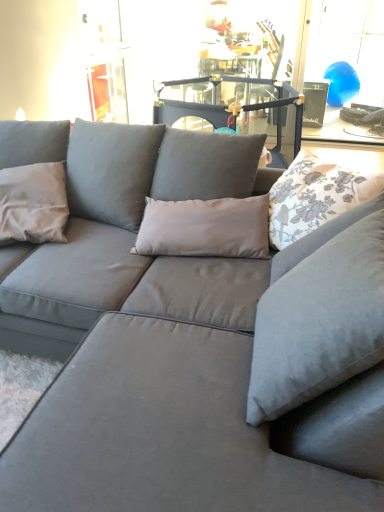
In order to face blue glossy balloon at upper right, should I rotate leftwards or rightwards?

Turn right by 20.594 degrees to look at blue glossy balloon at upper right.

Measure the distance between matte gray pillow at left, the first pillow from the left, and camera.

matte gray pillow at left, the first pillow from the left, is 5.69 feet from camera.

Identify the location of white floral fabric pillow at upper right, arranged as the second pillow when viewed from the left. The height and width of the screenshot is (512, 384). (315, 196).

Between matte gray pillow at left, the first pillow from the left, and blue glossy balloon at upper right, which one has larger width?

matte gray pillow at left, the first pillow from the left, is wider.

From the picture: From the image's perspective, which object appears higher, matte gray pillow at left, the 2th pillow positioned from the right, or blue glossy balloon at upper right?

From the image's view, blue glossy balloon at upper right is above.

Identify the location of pillow beneath the blue glossy balloon at upper right (from a real-world perspective). tap(33, 203).

Can blue glossy balloon at upper right be found inside white floral fabric pillow at upper right, arranged as the second pillow when viewed from the left?

No, blue glossy balloon at upper right is not inside white floral fabric pillow at upper right, arranged as the second pillow when viewed from the left.

From a real-world perspective, who is located lower, white floral fabric pillow at upper right, acting as the 1th pillow starting from the right, or blue glossy balloon at upper right?

From a 3D spatial view, blue glossy balloon at upper right is below.

Which of these two, white floral fabric pillow at upper right, arranged as the second pillow when viewed from the left, or blue glossy balloon at upper right, stands taller?

blue glossy balloon at upper right is taller.

Is white floral fabric pillow at upper right, arranged as the second pillow when viewed from the left, positioned before blue glossy balloon at upper right?

Yes, white floral fabric pillow at upper right, arranged as the second pillow when viewed from the left, is closer to the viewer.

I want to click on window that appears above the matte gray pillow at left, the first pillow from the left (from the image's perspective), so click(x=349, y=42).

From a real-world perspective, which object stands above the other?

From a 3D spatial view, blue glossy balloon at upper right is above.

Considering the sizes of objects blue glossy balloon at upper right and matte gray pillow at left, the first pillow from the left, in the image provided, who is thinner, blue glossy balloon at upper right or matte gray pillow at left, the first pillow from the left,?

Thinner between the two is blue glossy balloon at upper right.

Consider the image. Is blue glossy balloon at upper right shorter than matte gray pillow at left, the 2th pillow positioned from the right?

No.

From the image's perspective, does matte gray pillow at left, the 2th pillow positioned from the right, appear lower than white floral fabric pillow at upper right, acting as the 1th pillow starting from the right?

Indeed, from the image's perspective, matte gray pillow at left, the 2th pillow positioned from the right, is shown beneath white floral fabric pillow at upper right, acting as the 1th pillow starting from the right.

Is matte gray pillow at left, the 2th pillow positioned from the right, wider or thinner than white floral fabric pillow at upper right, acting as the 1th pillow starting from the right?

Clearly, matte gray pillow at left, the 2th pillow positioned from the right, has less width compared to white floral fabric pillow at upper right, acting as the 1th pillow starting from the right.

Is matte gray pillow at left, the 2th pillow positioned from the right, positioned with its back to white floral fabric pillow at upper right, acting as the 1th pillow starting from the right?

That's not correct — matte gray pillow at left, the 2th pillow positioned from the right, is not looking away from white floral fabric pillow at upper right, acting as the 1th pillow starting from the right.

Is white floral fabric pillow at upper right, acting as the 1th pillow starting from the right, taller or shorter than matte gray pillow at left, the 2th pillow positioned from the right?

In the image, white floral fabric pillow at upper right, acting as the 1th pillow starting from the right, appears to be shorter than matte gray pillow at left, the 2th pillow positioned from the right.

From a real-world perspective, relative to matte gray pillow at left, the first pillow from the left, is white floral fabric pillow at upper right, arranged as the second pillow when viewed from the left, vertically above or below?

Clearly, from a real-world perspective, white floral fabric pillow at upper right, arranged as the second pillow when viewed from the left, is above matte gray pillow at left, the first pillow from the left.

Looking at this image, choose the correct answer: Is white floral fabric pillow at upper right, arranged as the second pillow when viewed from the left, inside matte gray pillow at left, the 2th pillow positioned from the right, or outside it?

white floral fabric pillow at upper right, arranged as the second pillow when viewed from the left, lies outside matte gray pillow at left, the 2th pillow positioned from the right.

Considering the positions of points (297, 233) and (4, 244), is point (297, 233) closer to camera compared to point (4, 244)?

Yes, it is.

In terms of size, does blue glossy balloon at upper right appear bigger or smaller than white floral fabric pillow at upper right, arranged as the second pillow when viewed from the left?

In the image, blue glossy balloon at upper right appears to be larger than white floral fabric pillow at upper right, arranged as the second pillow when viewed from the left.

Is blue glossy balloon at upper right aimed at white floral fabric pillow at upper right, arranged as the second pillow when viewed from the left?

Yes, blue glossy balloon at upper right is facing white floral fabric pillow at upper right, arranged as the second pillow when viewed from the left.

From a real-world perspective, is blue glossy balloon at upper right below white floral fabric pillow at upper right, arranged as the second pillow when viewed from the left?

Yes, from a real-world perspective, blue glossy balloon at upper right is below white floral fabric pillow at upper right, arranged as the second pillow when viewed from the left.

Can you confirm if blue glossy balloon at upper right is positioned to the right of white floral fabric pillow at upper right, acting as the 1th pillow starting from the right?

Correct, you'll find blue glossy balloon at upper right to the right of white floral fabric pillow at upper right, acting as the 1th pillow starting from the right.

I want to click on window behind the matte gray pillow at left, the 2th pillow positioned from the right, so click(x=349, y=42).

Find the location of `window that is on the right side of white floral fabric pillow at upper right, arranged as the second pillow when viewed from the left`. window that is on the right side of white floral fabric pillow at upper right, arranged as the second pillow when viewed from the left is located at coordinates (349, 42).

Based on their spatial positions, is blue glossy balloon at upper right or white floral fabric pillow at upper right, arranged as the second pillow when viewed from the left, closer to matte gray pillow at left, the 2th pillow positioned from the right?

The object closer to matte gray pillow at left, the 2th pillow positioned from the right, is white floral fabric pillow at upper right, arranged as the second pillow when viewed from the left.

When comparing their distances from white floral fabric pillow at upper right, arranged as the second pillow when viewed from the left, does blue glossy balloon at upper right or matte gray pillow at left, the first pillow from the left, seem further?

blue glossy balloon at upper right is further to white floral fabric pillow at upper right, arranged as the second pillow when viewed from the left.

Looking at the image, which one is located further to matte gray pillow at left, the first pillow from the left, white floral fabric pillow at upper right, acting as the 1th pillow starting from the right, or blue glossy balloon at upper right?

blue glossy balloon at upper right is positioned further to the anchor matte gray pillow at left, the first pillow from the left.

When comparing their distances from blue glossy balloon at upper right, does matte gray pillow at left, the first pillow from the left, or white floral fabric pillow at upper right, arranged as the second pillow when viewed from the left, seem closer?

Among the two, white floral fabric pillow at upper right, arranged as the second pillow when viewed from the left, is located nearer to blue glossy balloon at upper right.

Based on their spatial positions, is white floral fabric pillow at upper right, arranged as the second pillow when viewed from the left, or matte gray pillow at left, the 2th pillow positioned from the right, further from blue glossy balloon at upper right?

Among the two, matte gray pillow at left, the 2th pillow positioned from the right, is located further to blue glossy balloon at upper right.

From the image, which object appears to be nearer to white floral fabric pillow at upper right, acting as the 1th pillow starting from the right, matte gray pillow at left, the first pillow from the left, or blue glossy balloon at upper right?

matte gray pillow at left, the first pillow from the left, is closer to white floral fabric pillow at upper right, acting as the 1th pillow starting from the right.

Locate an element on the screen. pillow between white floral fabric pillow at upper right, arranged as the second pillow when viewed from the left, and blue glossy balloon at upper right in the front-back direction is located at coordinates (33, 203).